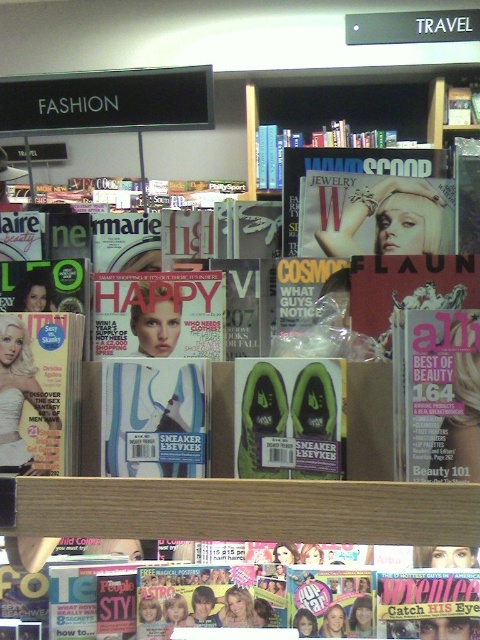
Can you confirm if black plastic signboard at upper center is positioned to the left of matte glossy cover at center?

In fact, black plastic signboard at upper center is to the right of matte glossy cover at center.

Does black plastic signboard at upper center appear over matte glossy cover at center?

Indeed, black plastic signboard at upper center is positioned over matte glossy cover at center.

Who is more distant from viewer, (134, 84) or (38, 440)?

Positioned behind is point (134, 84).

Locate an element on the screen. black plastic signboard at upper center is located at coordinates (108, 100).

Is green matte sneakers at center thinner than matte blue sneaker at center?

Indeed, green matte sneakers at center has a lesser width compared to matte blue sneaker at center.

You are a GUI agent. You are given a task and a screenshot of the screen. Output one action in this format:
    pyautogui.click(x=<x>, y=<y>)
    Task: Click on the green matte sneakers at center
    The height and width of the screenshot is (640, 480).
    Given the screenshot: What is the action you would take?
    pyautogui.click(x=289, y=419)

Between green matte sneakers at center and matte pink cover at center, which one appears on the left side from the viewer's perspective?

green matte sneakers at center

Between green matte sneakers at center and matte pink cover at center, which one appears on the right side from the viewer's perspective?

From the viewer's perspective, matte pink cover at center appears more on the right side.

Identify the location of green matte sneakers at center. This screenshot has width=480, height=640. (289, 419).